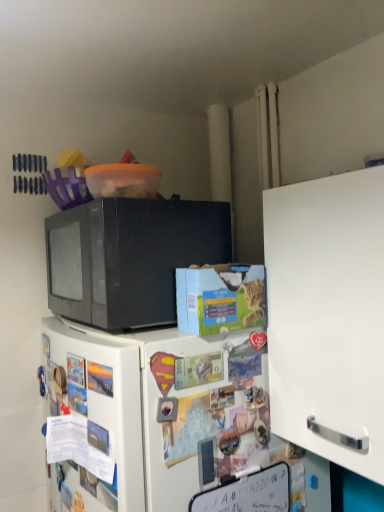
Question: Looking at their shapes, would you say white matte cabinet at right is wider or thinner than white matte refrigerator at center?

Choices:
 (A) thin
 (B) wide

Answer: (A)

Question: From a real-world perspective, relative to white matte refrigerator at center, is white matte cabinet at right vertically above or below?

Choices:
 (A) below
 (B) above

Answer: (B)

Question: Based on their relative distances, which object is nearer to the white matte cabinet at right?

Choices:
 (A) white matte refrigerator at center
 (B) black matte microwave at upper left

Answer: (A)

Question: Estimate the real-world distances between objects in this image. Which object is farther from the white matte refrigerator at center?

Choices:
 (A) black matte microwave at upper left
 (B) white matte cabinet at right

Answer: (B)